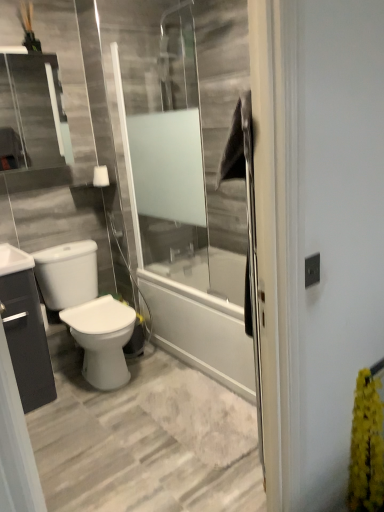
Question: From a real-world perspective, is white glossy toilet at lower left physically located above or below yellow fluffy plant at right?

Choices:
 (A) below
 (B) above

Answer: (B)

Question: Do you think white glossy toilet at lower left is within yellow fluffy plant at right, or outside of it?

Choices:
 (A) outside
 (B) inside

Answer: (A)

Question: Based on their relative distances, which object is nearer to the matte black cabinet at left?

Choices:
 (A) yellow fluffy plant at right
 (B) white glossy toilet at lower left

Answer: (B)

Question: Estimate the real-world distances between objects in this image. Which object is closer to the white glossy toilet at lower left?

Choices:
 (A) matte black cabinet at left
 (B) yellow fluffy plant at right

Answer: (A)